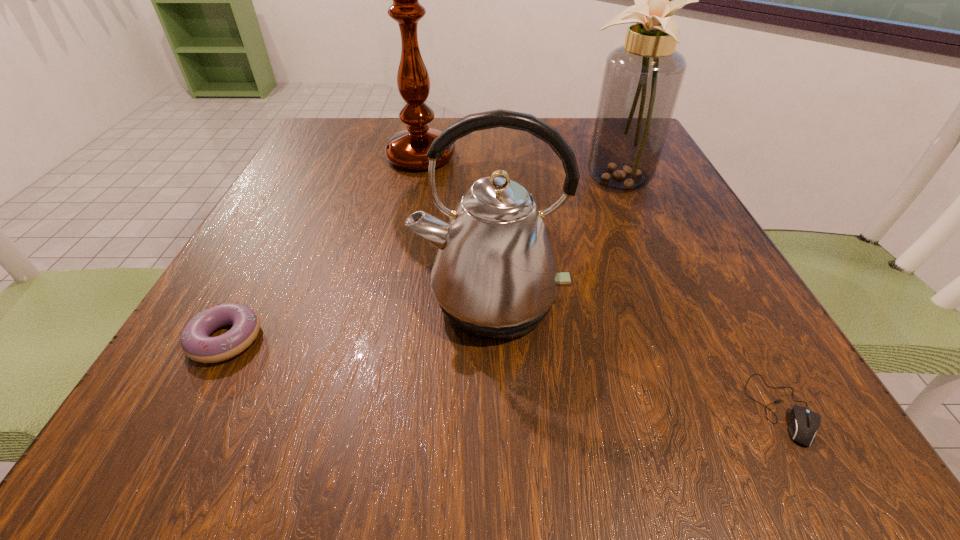
What are the coordinates of `the tallest object` in the screenshot? It's located at (407, 149).

Locate an element on the screen. This screenshot has width=960, height=540. the second tallest object is located at coordinates (642, 79).

Locate an element on the screen. The image size is (960, 540). the third tallest object is located at coordinates (495, 276).

Identify the location of doughnut. (196, 343).

Locate an element on the screen. the leftmost object is located at coordinates 196,343.

What are the coordinates of `computer mouse` in the screenshot? It's located at (804, 423).

Where is `the shortest object`? the shortest object is located at coordinates (804, 423).

This screenshot has width=960, height=540. What are the coordinates of `vacant space located 0.160m on the front of the table lamp` in the screenshot? It's located at pos(403,247).

This screenshot has width=960, height=540. What are the coordinates of `free spot located 0.270m on the left of the flower arrangement` in the screenshot? It's located at (442, 175).

What are the coordinates of `vacant area located 0.070m from the spout of the third shortest object` in the screenshot? It's located at (493, 396).